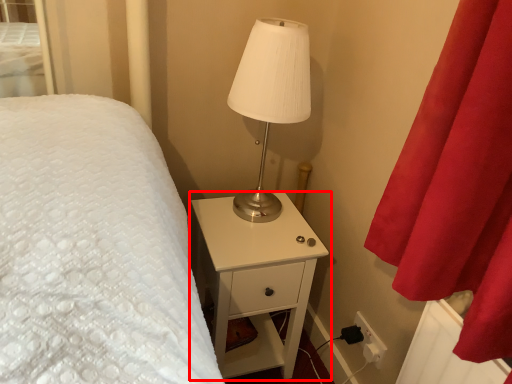
Question: From the image, what is the correct spatial relationship of nightstand (annotated by the red box) in relation to lamp?

Choices:
 (A) left
 (B) right

Answer: (A)